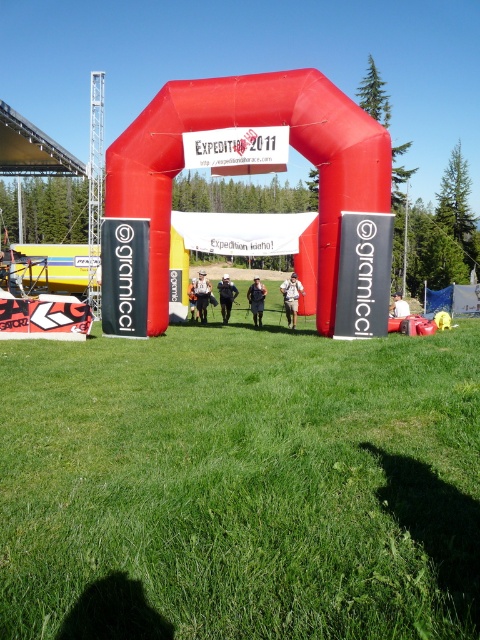
Question: Estimate the real-world distances between objects in this image. Which object is farther from the dark blue jeans at center?

Choices:
 (A) camouflage jacket at center
 (B) dark gray jacket at center
 (C) white fabric person at center
 (D) orange fabric jacket at center

Answer: (C)

Question: In this image, where is dark blue jeans at center located relative to dark gray jacket at center?

Choices:
 (A) above
 (B) below

Answer: (B)

Question: Which point is closer to the camera taking this photo?

Choices:
 (A) (227, 298)
 (B) (288, 282)
 (C) (253, 294)

Answer: (B)

Question: Can you confirm if camouflage jacket at center is wider than dark gray jacket at center?

Choices:
 (A) yes
 (B) no

Answer: (A)

Question: Among these objects, which one is farthest from the camera?

Choices:
 (A) dark gray jacket at center
 (B) white fabric person at center
 (C) dark blue jeans at center

Answer: (A)

Question: Can you confirm if dark blue jeans at center is smaller than white fabric person at center?

Choices:
 (A) no
 (B) yes

Answer: (B)